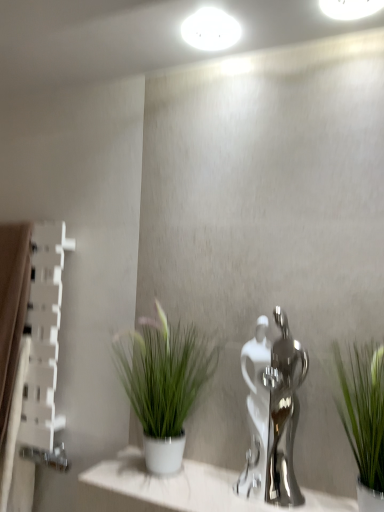
Question: Is green leafy plant at right, the first houseplant positioned from the right, in contact with polished chrome faucet at center?

Choices:
 (A) yes
 (B) no

Answer: (B)

Question: Is polished chrome faucet at center inside green leafy plant at right, the first houseplant positioned from the right?

Choices:
 (A) no
 (B) yes

Answer: (A)

Question: Is green leafy plant at right, which is the second houseplant from left to right, positioned beyond the bounds of polished chrome faucet at center?

Choices:
 (A) yes
 (B) no

Answer: (A)

Question: Is green leafy plant at right, the first houseplant positioned from the front, further to the viewer compared to polished chrome faucet at center?

Choices:
 (A) yes
 (B) no

Answer: (B)

Question: Is green leafy plant at right, the first houseplant positioned from the right, to the left of polished chrome faucet at center from the viewer's perspective?

Choices:
 (A) no
 (B) yes

Answer: (A)

Question: Is point (369, 450) positioned closer to the camera than point (16, 318)?

Choices:
 (A) farther
 (B) closer

Answer: (B)

Question: Would you say green leafy plant at right, acting as the second houseplant starting from the back, is inside or outside brown fabric curtain at left?

Choices:
 (A) outside
 (B) inside

Answer: (A)

Question: Looking at the image, does green leafy plant at right, acting as the second houseplant starting from the back, seem bigger or smaller compared to brown fabric curtain at left?

Choices:
 (A) big
 (B) small

Answer: (B)

Question: From the image's perspective, is green leafy plant at right, which is the second houseplant from left to right, positioned above or below brown fabric curtain at left?

Choices:
 (A) below
 (B) above

Answer: (B)

Question: Considering their positions, is brown fabric curtain at left located in front of or behind white glossy light fixture at upper center, acting as the first lighting starting from the right?

Choices:
 (A) behind
 (B) front

Answer: (A)

Question: From a real-world perspective, is brown fabric curtain at left above or below white glossy light fixture at upper center, which is the 2th lighting from left to right?

Choices:
 (A) above
 (B) below

Answer: (B)

Question: From the image's perspective, is brown fabric curtain at left above or below white glossy light fixture at upper center, acting as the first lighting starting from the front?

Choices:
 (A) above
 (B) below

Answer: (B)

Question: From their relative heights in the image, would you say brown fabric curtain at left is taller or shorter than white glossy light fixture at upper center, which is the 2th lighting from left to right?

Choices:
 (A) tall
 (B) short

Answer: (A)

Question: Visually, is brown fabric curtain at left positioned to the left or to the right of white glossy ledge at center?

Choices:
 (A) left
 (B) right

Answer: (A)

Question: From a real-world perspective, relative to white glossy ledge at center, is brown fabric curtain at left vertically above or below?

Choices:
 (A) below
 (B) above

Answer: (B)